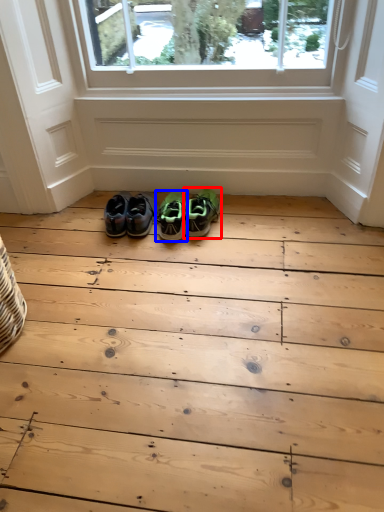
Question: Among these objects, which one is nearest to the camera, footwear (highlighted by a red box) or footwear (highlighted by a blue box)?

Choices:
 (A) footwear
 (B) footwear

Answer: (A)